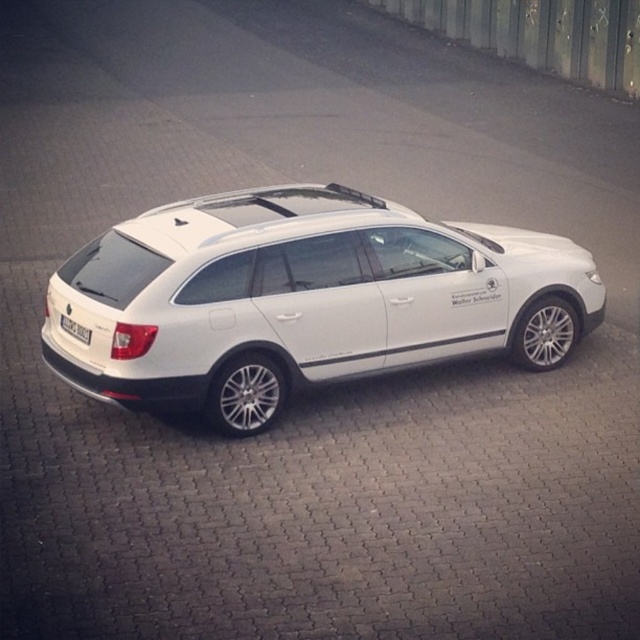
Does white metallic car at center have a smaller size compared to white plastic license plate at lower left?

Incorrect, white metallic car at center is not smaller in size than white plastic license plate at lower left.

Between point (161, 305) and point (67, 321), which one is positioned behind?

The point (67, 321) is behind.

The height and width of the screenshot is (640, 640). Identify the location of white metallic car at center. (304, 298).